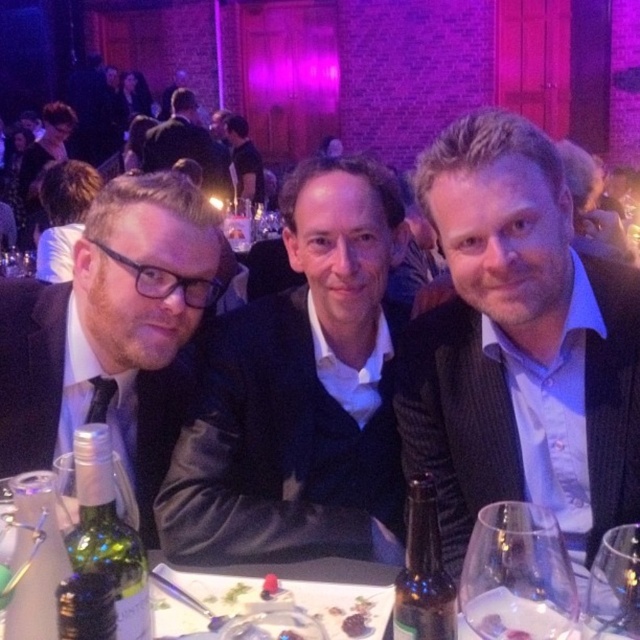
Based on the photo, does dark brown leather jacket at center have a larger size compared to matte black shirt at center?

Yes.

Is point (168, 168) closer to camera compared to point (244, 129)?

Yes.

Does point (172, 148) come in front of point (248, 172)?

Yes, point (172, 148) is in front of point (248, 172).

The image size is (640, 640). Identify the location of dark brown leather jacket at center. (188, 145).

Can you confirm if green glass bottle at center is taller than dark brown leather jacket at center?

No, green glass bottle at center is not taller than dark brown leather jacket at center.

Is point (406, 556) behind point (177, 150)?

No.

Locate an element on the screen. The width and height of the screenshot is (640, 640). green glass bottle at center is located at coordinates (422, 572).

Is green glass bottle at lower left taller than matte black shirt at center?

In fact, green glass bottle at lower left may be shorter than matte black shirt at center.

Image resolution: width=640 pixels, height=640 pixels. Identify the location of green glass bottle at lower left. (108, 532).

Where is `green glass bottle at lower left`? green glass bottle at lower left is located at coordinates (108, 532).